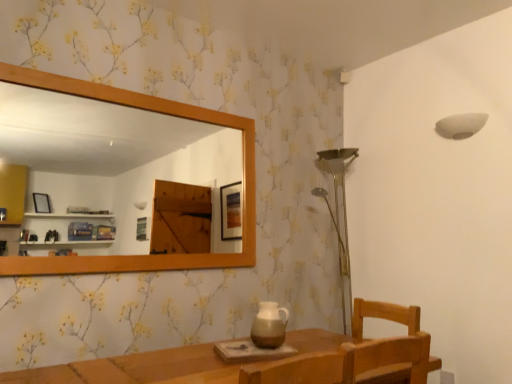
Image resolution: width=512 pixels, height=384 pixels. I want to click on vacant space situated above wooden mirror at upper left (from a real-world perspective), so click(x=129, y=83).